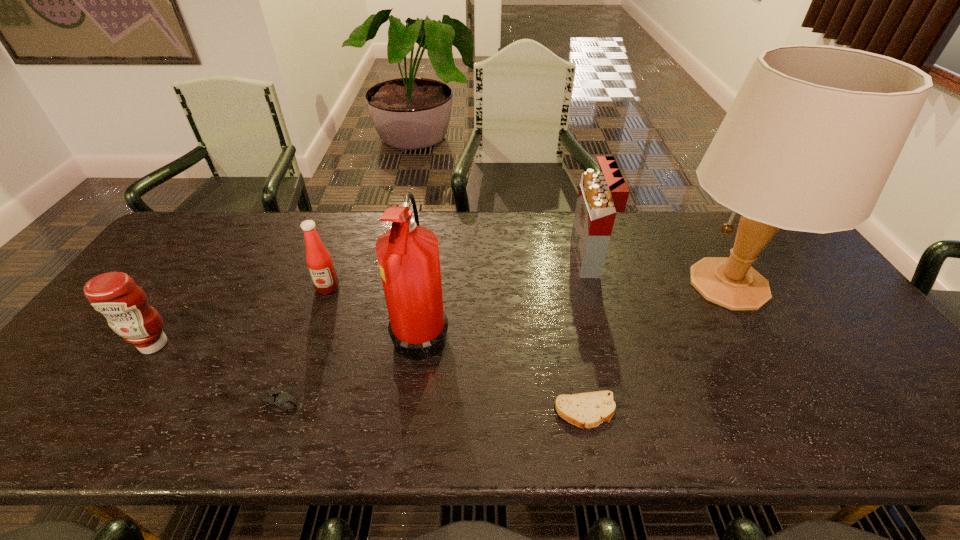
What are the coordinates of `vacant space at the far left corner of the desktop` in the screenshot? It's located at (205, 211).

Locate an element on the screen. Image resolution: width=960 pixels, height=540 pixels. free space at the far right corner is located at coordinates (779, 254).

Locate an element on the screen. free spot between the nearer condiment and the fifth shortest object is located at coordinates (371, 301).

Locate an element on the screen. The image size is (960, 540). vacant space that is in between the right condiment and the fifth shortest object is located at coordinates (458, 273).

Locate an element on the screen. vacant space in between the nearer condiment and the shortest object is located at coordinates (370, 378).

In order to click on free area in between the computer mouse and the pita bread in this screenshot , I will do `click(432, 407)`.

I want to click on blank region between the rightmost object and the cigarette case, so click(x=659, y=271).

You are a GUI agent. You are given a task and a screenshot of the screen. Output one action in this format:
    pyautogui.click(x=<x>, y=<y>)
    Task: Click on the blank region between the pita bread and the computer mouse
    The height and width of the screenshot is (540, 960).
    Given the screenshot: What is the action you would take?
    pyautogui.click(x=432, y=407)

I want to click on vacant space that is in between the left condiment and the second shortest object, so click(216, 374).

Identify the location of vacant area that lies between the fourth object from right to left and the cigarette case. The width and height of the screenshot is (960, 540). (505, 294).